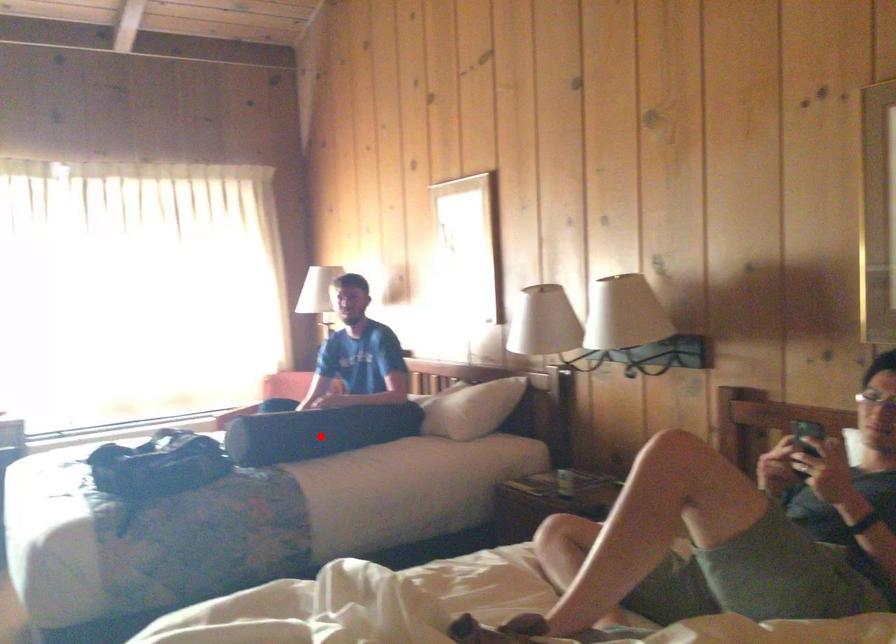
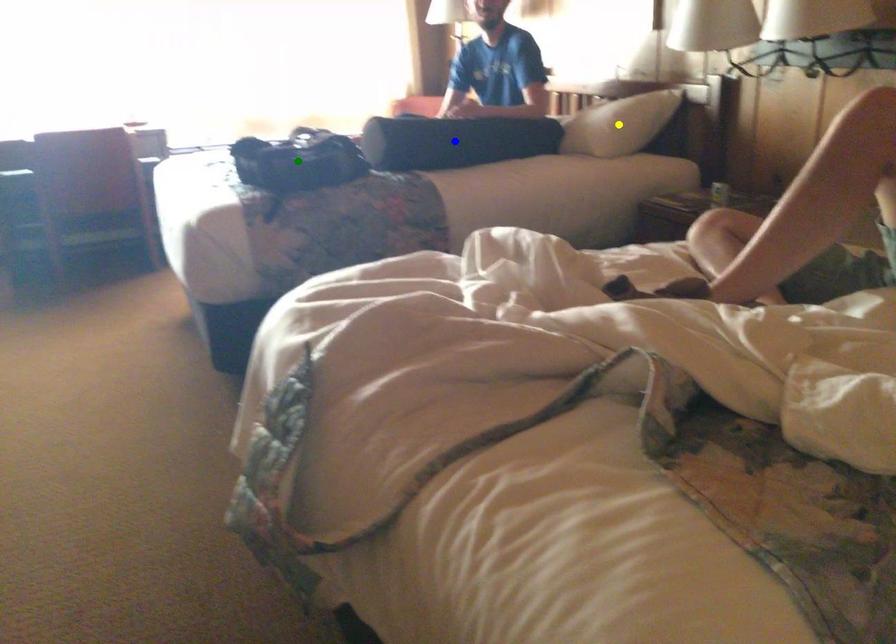
Question: I am providing you with two images of the same scene from different viewpoints. A red point is marked on the first image. You are given multiple points on the second image. Which spot in image 2 lines up with the point in image 1?

Choices:
 (A) blue point
 (B) yellow point
 (C) green point

Answer: (A)